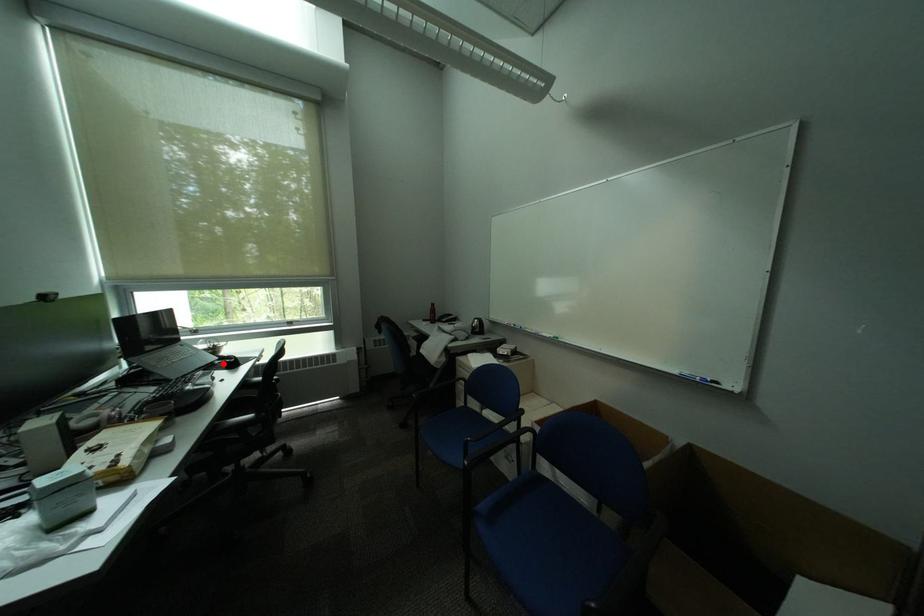
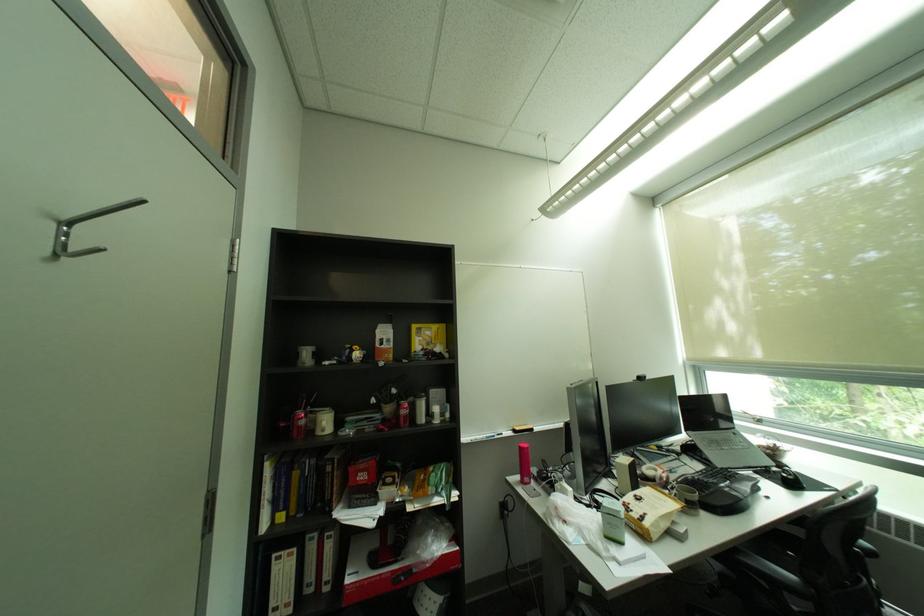
In the second image, find the point that corresponds to the highlighted location in the first image.

(777, 468)